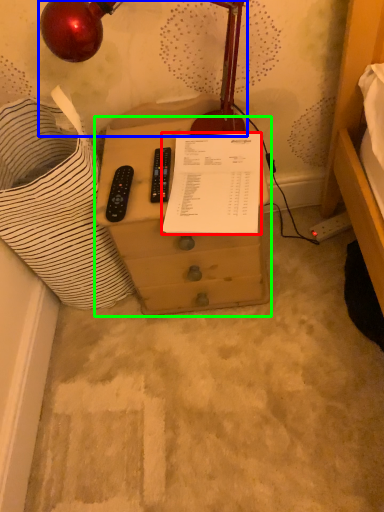
Question: Which object is the closest to the document (highlighted by a red box)? Choose among these: lamp (highlighted by a blue box) or furniture (highlighted by a green box).

Choices:
 (A) lamp
 (B) furniture

Answer: (B)